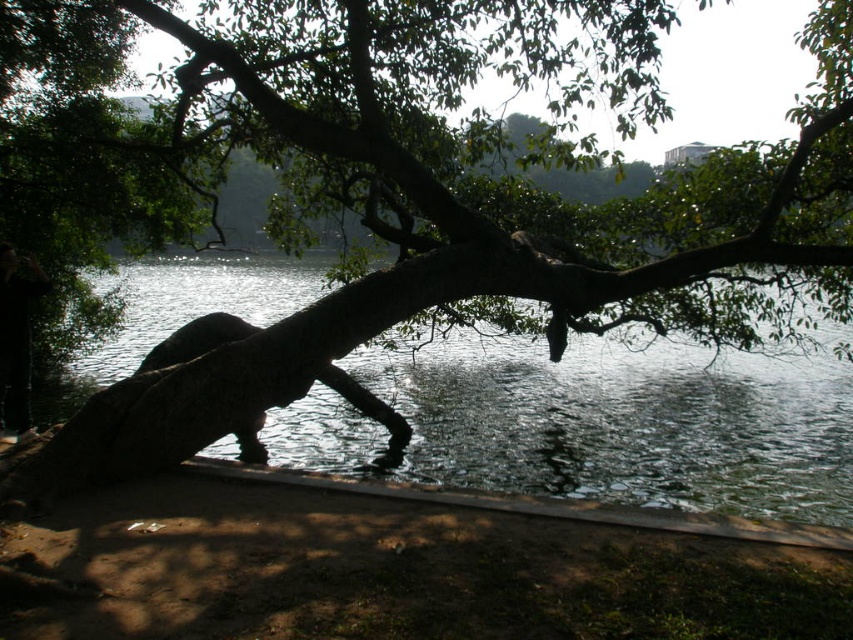
Who is positioned more to the left, clear water at lower center or black matte person at left?

Positioned to the left is black matte person at left.

Between point (572, 426) and point (10, 310), which one is positioned behind?

Positioned behind is point (572, 426).

Where is `clear water at lower center`? This screenshot has width=853, height=640. clear water at lower center is located at coordinates (624, 422).

Between smooth bark tree trunk at center and clear water at lower center, which one appears on the left side from the viewer's perspective?

clear water at lower center

Does smooth bark tree trunk at center appear under clear water at lower center?

No, smooth bark tree trunk at center is not below clear water at lower center.

Find the location of a particular element. The width and height of the screenshot is (853, 640). smooth bark tree trunk at center is located at coordinates (422, 186).

Is smooth bark tree trunk at center further to camera compared to black matte person at left?

That is False.

Which is below, smooth bark tree trunk at center or black matte person at left?

black matte person at left is lower down.

Does point (846, 257) lie behind point (9, 248)?

That is False.

The width and height of the screenshot is (853, 640). Identify the location of smooth bark tree trunk at center. (422, 186).